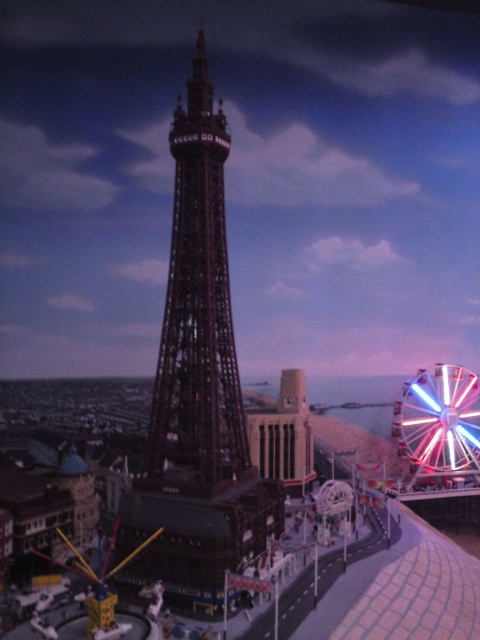
Does black matte tower at center appear on the left side of shiny metallic carousel at center?

Indeed, black matte tower at center is positioned on the left side of shiny metallic carousel at center.

Is point (147, 532) positioned before point (256, 476)?

That is True.

Find the location of a particular element. black matte tower at center is located at coordinates (196, 390).

In the scene shown: Does black matte tower at center have a lesser height compared to multicolored metallic ferris wheel at lower right?

No.

Is black matte tower at center to the right of multicolored metallic ferris wheel at lower right from the viewer's perspective?

No, black matte tower at center is not to the right of multicolored metallic ferris wheel at lower right.

Which is behind, point (220, 298) or point (445, 369)?

Point (445, 369)

You are a GUI agent. You are given a task and a screenshot of the screen. Output one action in this format:
    pyautogui.click(x=<x>, y=<y>)
    Task: Click on the black matte tower at center
    The width and height of the screenshot is (480, 640).
    Given the screenshot: What is the action you would take?
    pyautogui.click(x=196, y=390)

Is shiny metallic carousel at center further to the viewer compared to multicolored metallic ferris wheel at lower right?

That is False.

Is shiny metallic carousel at center above multicolored metallic ferris wheel at lower right?

No, shiny metallic carousel at center is not above multicolored metallic ferris wheel at lower right.

Identify the location of shiny metallic carousel at center. Image resolution: width=480 pixels, height=640 pixels. (190, 544).

You are a GUI agent. You are given a task and a screenshot of the screen. Output one action in this format:
    pyautogui.click(x=<x>, y=<y>)
    Task: Click on the shiny metallic carousel at center
    This screenshot has width=480, height=640.
    Given the screenshot: What is the action you would take?
    pyautogui.click(x=190, y=544)